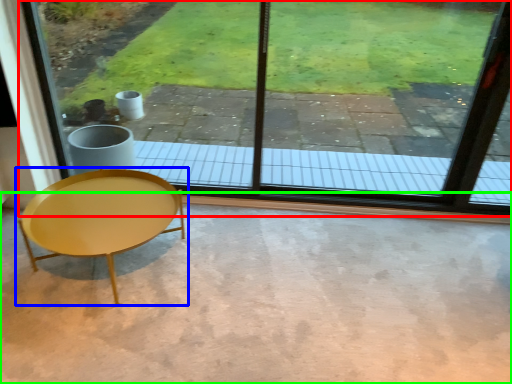
Question: Based on their relative distances, which object is nearer to window (highlighted by a red box)? Choose from coffee table (highlighted by a blue box) and concrete (highlighted by a green box).

Choices:
 (A) coffee table
 (B) concrete

Answer: (B)